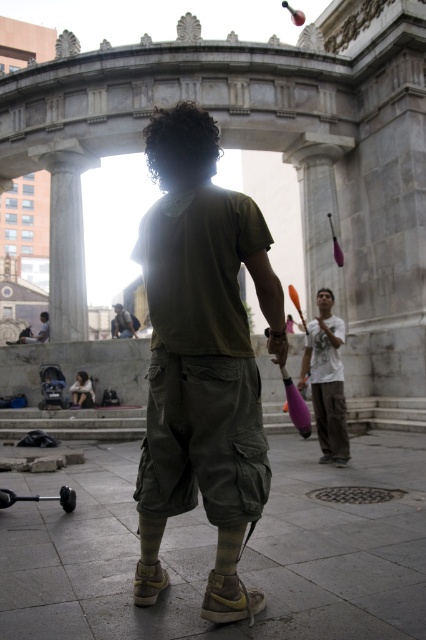
Question: Which point is farther to the camera?

Choices:
 (A) matte green t-shirt at center
 (B) white cotton shirt at center
 (C) concrete tiles at center
 (D) curly hair at center

Answer: (B)

Question: Which of the following is the farthest from the observer?

Choices:
 (A) curly hair at center
 (B) matte green t-shirt at center
 (C) khaki cargo shorts at center
 (D) white cotton shirt at center

Answer: (C)

Question: Does curly hair at center have a larger size compared to white cotton shirt at center?

Choices:
 (A) no
 (B) yes

Answer: (B)

Question: Based on their relative distances, which object is nearer to the concrete tiles at center?

Choices:
 (A) white cotton shirt at center
 (B) matte green t-shirt at center
 (C) khaki cargo shorts at center
 (D) curly hair at center

Answer: (B)

Question: Does curly hair at center have a smaller size compared to khaki cargo shorts at center?

Choices:
 (A) no
 (B) yes

Answer: (A)

Question: Is concrete tiles at center to the right of matte green t-shirt at center from the viewer's perspective?

Choices:
 (A) no
 (B) yes

Answer: (B)